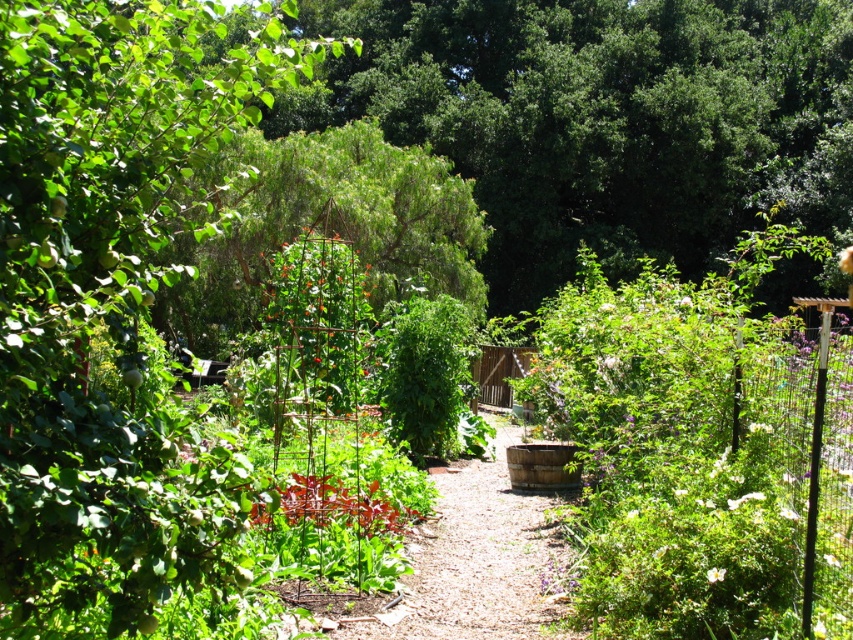
Question: Does green leafy tree at upper left have a smaller size compared to dirt path at center?

Choices:
 (A) no
 (B) yes

Answer: (A)

Question: Among these points, which one is farthest from the camera?

Choices:
 (A) (129, 616)
 (B) (503, 547)

Answer: (B)

Question: Can you confirm if green leafy tree at upper left is positioned to the right of green leafy tree at center?

Choices:
 (A) no
 (B) yes

Answer: (A)

Question: Is green leafy tree at center bigger than dirt path at center?

Choices:
 (A) yes
 (B) no

Answer: (A)

Question: Which point is closer to the camera?

Choices:
 (A) dirt path at center
 (B) green leafy tree at upper left

Answer: (B)

Question: Which of the following is the closest to the observer?

Choices:
 (A) (505, 420)
 (B) (256, 278)

Answer: (A)